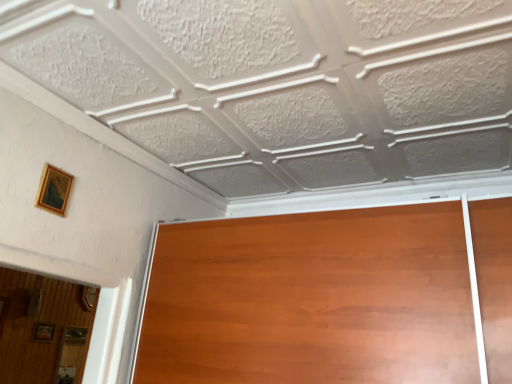
Question: Is wooden picture frame at lower left, marked as the 2th picture frame in a right-to-left arrangement, at the left side of gold wooden picture frame at upper left, marked as the second picture frame in a left-to-right arrangement?

Choices:
 (A) yes
 (B) no

Answer: (A)

Question: Is wooden picture frame at lower left, the 2th picture frame in the front-to-back sequence, positioned far away from gold wooden picture frame at upper left, marked as the second picture frame in a left-to-right arrangement?

Choices:
 (A) yes
 (B) no

Answer: (A)

Question: Can you confirm if wooden picture frame at lower left, the 1th picture frame when ordered from left to right, is bigger than gold wooden picture frame at upper left, marked as the 1th picture frame in a front-to-back arrangement?

Choices:
 (A) yes
 (B) no

Answer: (A)

Question: Does wooden picture frame at lower left, the 2th picture frame in the front-to-back sequence, have a greater width compared to gold wooden picture frame at upper left, the second picture frame when ordered from bottom to top?

Choices:
 (A) no
 (B) yes

Answer: (B)

Question: From the image's perspective, is wooden picture frame at lower left, placed as the 2th picture frame when sorted from top to bottom, on gold wooden picture frame at upper left, the 2th picture frame when ordered from back to front?

Choices:
 (A) yes
 (B) no

Answer: (B)

Question: From the image's perspective, is wooden picture frame at lower left, the 1th picture frame when ordered from left to right, beneath gold wooden picture frame at upper left, placed as the first picture frame when sorted from right to left?

Choices:
 (A) yes
 (B) no

Answer: (A)

Question: Is gold wooden picture frame at upper left, placed as the first picture frame when sorted from right to left, to the left of wooden picture frame at lower left, the 2th picture frame in the front-to-back sequence, from the viewer's perspective?

Choices:
 (A) yes
 (B) no

Answer: (B)

Question: Is gold wooden picture frame at upper left, placed as the first picture frame when sorted from right to left, smaller than wooden picture frame at lower left, marked as the 2th picture frame in a right-to-left arrangement?

Choices:
 (A) yes
 (B) no

Answer: (A)

Question: Is wooden picture frame at lower left, marked as the 2th picture frame in a right-to-left arrangement, inside gold wooden picture frame at upper left, marked as the 1th picture frame in a front-to-back arrangement?

Choices:
 (A) yes
 (B) no

Answer: (B)

Question: Is gold wooden picture frame at upper left, the second picture frame when ordered from bottom to top, further to camera compared to wooden picture frame at lower left, marked as the 2th picture frame in a right-to-left arrangement?

Choices:
 (A) yes
 (B) no

Answer: (B)

Question: Is gold wooden picture frame at upper left, the second picture frame when ordered from bottom to top, positioned in front of wooden picture frame at lower left, marked as the 2th picture frame in a right-to-left arrangement?

Choices:
 (A) yes
 (B) no

Answer: (A)

Question: Are gold wooden picture frame at upper left, marked as the 1th picture frame in a front-to-back arrangement, and wooden picture frame at lower left, which is the first picture frame in bottom-to-top order, far apart?

Choices:
 (A) no
 (B) yes

Answer: (B)

Question: In terms of height, does gold wooden picture frame at upper left, the second picture frame when ordered from bottom to top, look taller or shorter compared to wooden picture frame at lower left, the first picture frame positioned from the back?

Choices:
 (A) short
 (B) tall

Answer: (B)